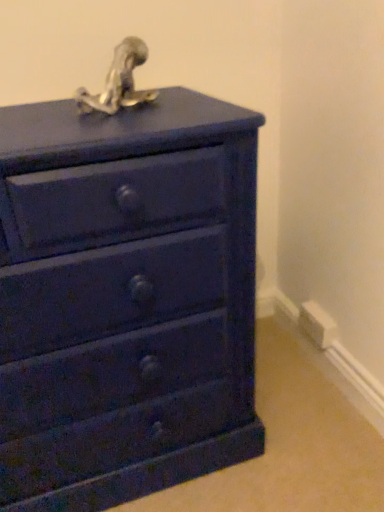
Question: From the image's perspective, is metallic silver sculpture at top under matte blue chest of drawers at center?

Choices:
 (A) no
 (B) yes

Answer: (A)

Question: Is the depth of metallic silver sculpture at top less than that of matte blue chest of drawers at center?

Choices:
 (A) yes
 (B) no

Answer: (B)

Question: Is metallic silver sculpture at top at the left side of matte blue chest of drawers at center?

Choices:
 (A) no
 (B) yes

Answer: (A)

Question: From the image's perspective, does metallic silver sculpture at top appear higher than matte blue chest of drawers at center?

Choices:
 (A) no
 (B) yes

Answer: (B)

Question: Can you confirm if metallic silver sculpture at top is thinner than matte blue chest of drawers at center?

Choices:
 (A) no
 (B) yes

Answer: (B)

Question: Is point (135, 96) closer or farther from the camera than point (137, 272)?

Choices:
 (A) farther
 (B) closer

Answer: (A)

Question: Is metallic silver sculpture at top situated inside matte blue chest of drawers at center or outside?

Choices:
 (A) inside
 (B) outside

Answer: (B)

Question: Based on their positions, is metallic silver sculpture at top located to the left or right of matte blue chest of drawers at center?

Choices:
 (A) right
 (B) left

Answer: (A)

Question: From the image's perspective, relative to matte blue chest of drawers at center, is metallic silver sculpture at top above or below?

Choices:
 (A) above
 (B) below

Answer: (A)

Question: Is matte blue chest of drawers at center inside or outside of white plastic electric outlet at lower right?

Choices:
 (A) inside
 (B) outside

Answer: (B)

Question: Is matte blue chest of drawers at center wider or thinner than white plastic electric outlet at lower right?

Choices:
 (A) wide
 (B) thin

Answer: (A)

Question: Based on their sizes in the image, would you say matte blue chest of drawers at center is bigger or smaller than white plastic electric outlet at lower right?

Choices:
 (A) small
 (B) big

Answer: (B)

Question: Considering the positions of matte blue chest of drawers at center and white plastic electric outlet at lower right in the image, is matte blue chest of drawers at center taller or shorter than white plastic electric outlet at lower right?

Choices:
 (A) tall
 (B) short

Answer: (A)

Question: Considering the positions of white plastic electric outlet at lower right and matte blue chest of drawers at center in the image, is white plastic electric outlet at lower right wider or thinner than matte blue chest of drawers at center?

Choices:
 (A) wide
 (B) thin

Answer: (B)

Question: Considering the positions of point (329, 314) and point (200, 272), is point (329, 314) closer or farther from the camera than point (200, 272)?

Choices:
 (A) closer
 (B) farther

Answer: (B)